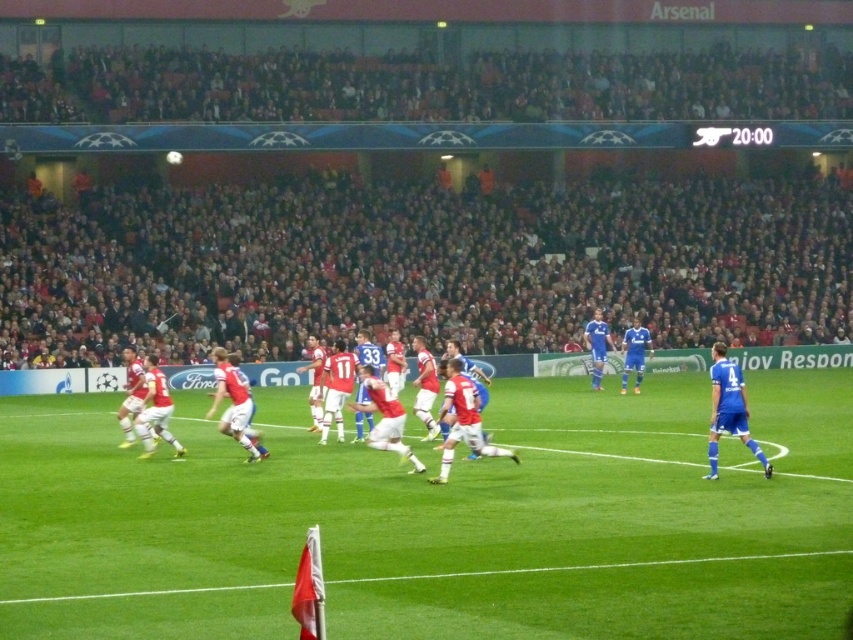
You are a drone operator trying to capture a closeup shot of the soccer match. Your drone is currently hovering at point 0.7, 0.5. To get the best shot of the green grass football field at center, should you move your drone north or south?

The green grass football field at center is located at point (x=440, y=522). Since your drone is at (x=426, y=448), you should move it north to align with the field.

You are a photographer standing at the edge of the soccer field. You want to take a photo that includes both the green grass football field at center and the blue smooth jersey at right. Which object will appear larger in your photo?

The green grass football field at center will appear larger in the photo because it is closer to the viewer than the blue smooth jersey at right.

You are standing at the point marked as point (160,621) on the soccer field. A soccer ball is rolling towards you from the direction of the corner flag in the bottom left corner. If the ball travels at a constant speed of 5 meters per second, how long will it take for the ball to reach you?

The distance between point (160,621) and the viewer is 10.07 meters. Since the ball is moving at 5 meters per second, it will take 10.07 divided by 5, which is approximately 2.01 seconds for the ball to reach you.